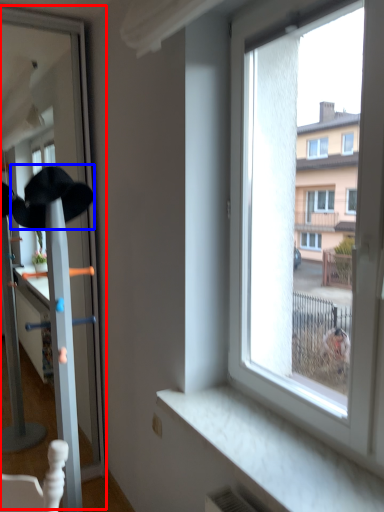
Question: Which of the following is the farthest to the observer, screen door (highlighted by a red box) or baseball hat (highlighted by a blue box)?

Choices:
 (A) screen door
 (B) baseball hat

Answer: (B)